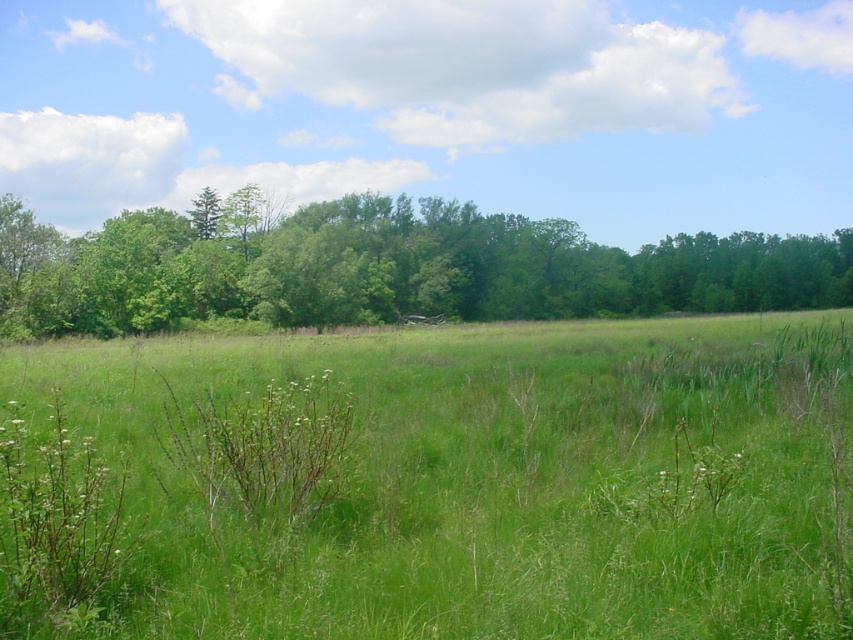
You are standing at the point labeled as point (434, 483) in the image. Based on the scene described, what type of terrain are you currently standing on?

The point (434, 483) corresponds to the green grassy field at center, so you are standing on a green grassy field.

You are standing in the meadow and see two points marked in the scene. The first point is at coordinates point (86, 451) and the second is at point (821, 264). Which point is closer to your current position?

Point (86, 451) is in front of point (821, 264), so it is closer to your current position.